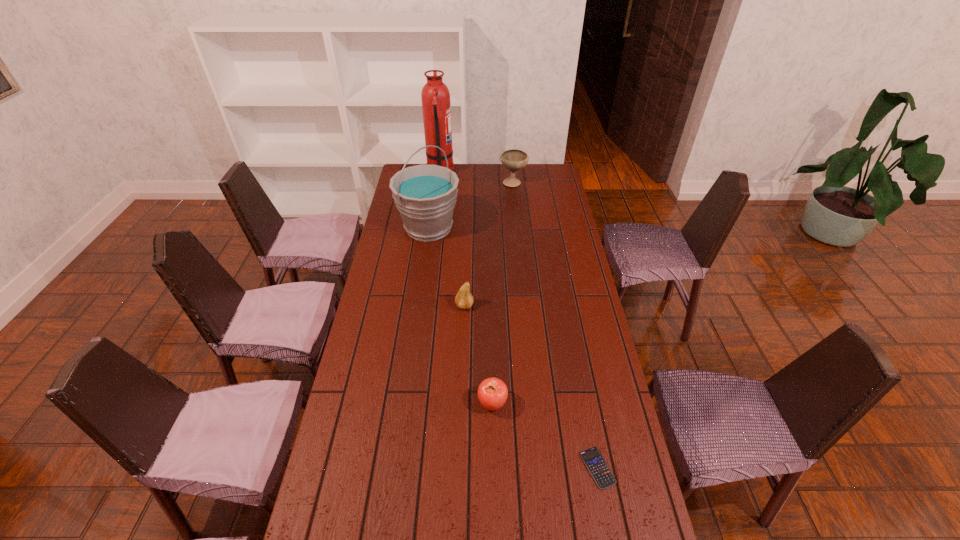
Locate an element on the screen. This screenshot has width=960, height=540. free space located on the label side of the fire extinguisher is located at coordinates (508, 174).

Find the location of a particular element. vacant region located 0.400m on the right of the fifth shortest object is located at coordinates [548, 228].

Where is `blank space located on the front of the third tallest object`? The image size is (960, 540). blank space located on the front of the third tallest object is located at coordinates pos(515,198).

You are a GUI agent. You are given a task and a screenshot of the screen. Output one action in this format:
    pyautogui.click(x=<x>, y=<y>)
    Task: Click on the free space located 0.210m on the left of the third nearest object
    This screenshot has width=960, height=540.
    Given the screenshot: What is the action you would take?
    pyautogui.click(x=399, y=306)

The width and height of the screenshot is (960, 540). I want to click on blank area located on the front of the third object from right to left, so click(494, 497).

I want to click on free spot located 0.320m on the back of the rightmost object, so click(576, 356).

Identify the location of fire extinguisher that is positioned at the far edge. This screenshot has width=960, height=540. (436, 107).

The image size is (960, 540). Find the location of `chalice located at the far edge`. chalice located at the far edge is located at coordinates (514, 159).

Where is `fire extinguisher that is at the left edge`? fire extinguisher that is at the left edge is located at coordinates (436, 107).

The image size is (960, 540). Identify the location of bucket that is at the left edge. (425, 195).